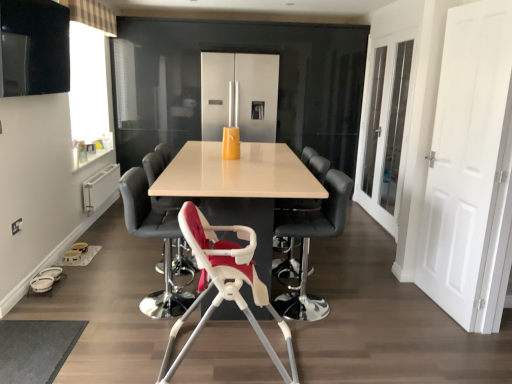
Where is `vacant space to the right of white plastic highchair at center, placed as the first chair when sorted from front to back`? The height and width of the screenshot is (384, 512). vacant space to the right of white plastic highchair at center, placed as the first chair when sorted from front to back is located at coordinates (339, 350).